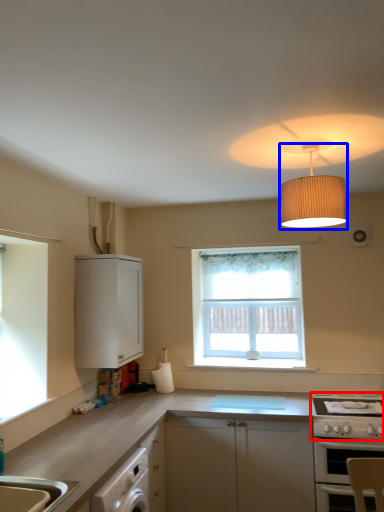
Question: Among these objects, which one is farthest to the camera, gas stove (highlighted by a red box) or lamp (highlighted by a blue box)?

Choices:
 (A) gas stove
 (B) lamp

Answer: (A)